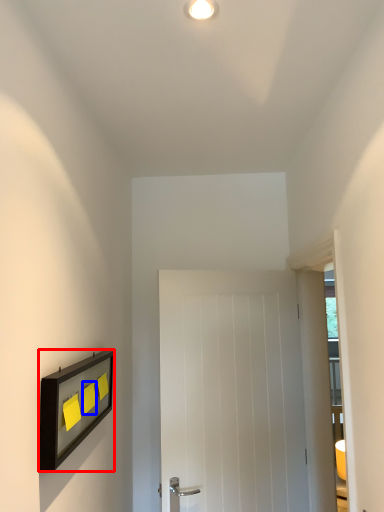
Question: Which object is closer to the camera taking this photo, picture frame (highlighted by a red box) or light switch (highlighted by a blue box)?

Choices:
 (A) picture frame
 (B) light switch

Answer: (A)